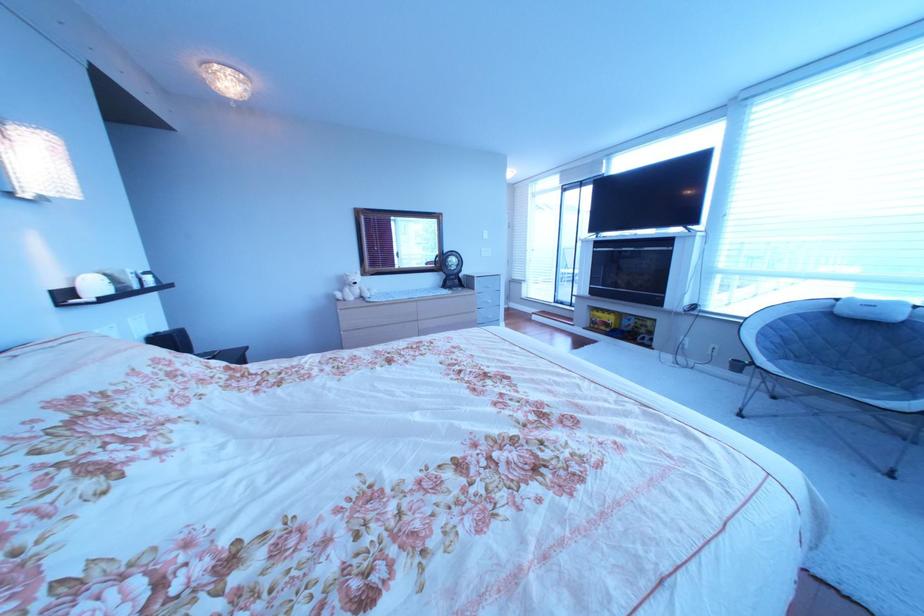
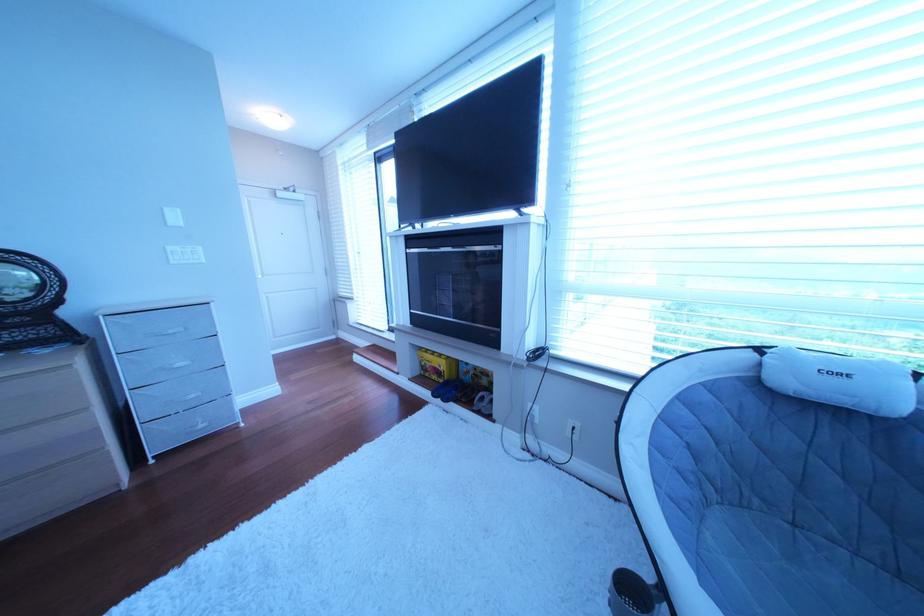
Locate, in the second image, the point that corresponds to (x=505, y=288) in the first image.

(188, 334)